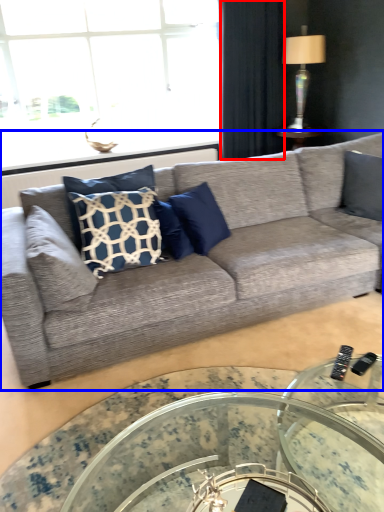
Question: Which point is further to the camera, curtain (highlighted by a red box) or studio couch (highlighted by a blue box)?

Choices:
 (A) curtain
 (B) studio couch

Answer: (A)